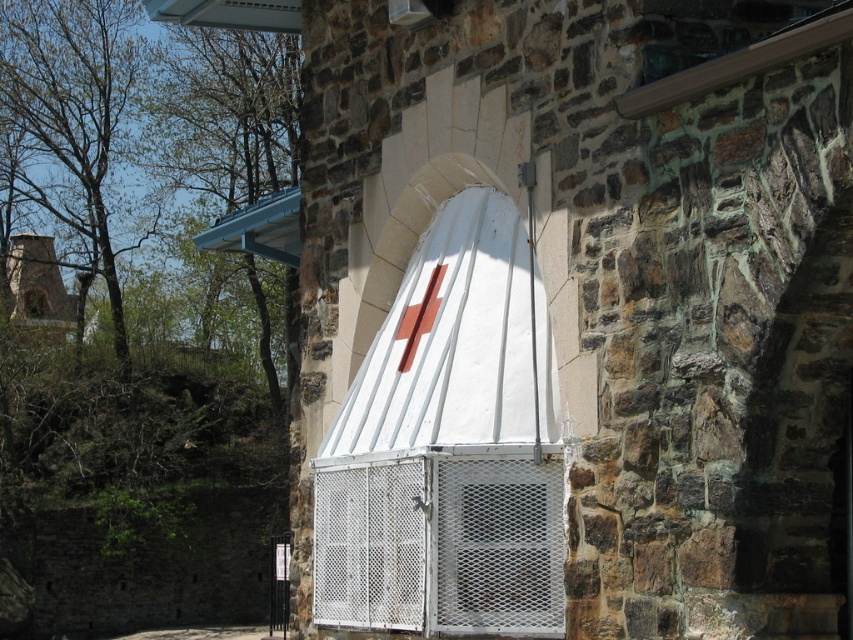
Question: Among these objects, which one is farthest from the camera?

Choices:
 (A) brick chimney at left
 (B) white mesh window at center

Answer: (B)

Question: Which of the following is the farthest from the observer?

Choices:
 (A) (30, 291)
 (B) (35, 314)

Answer: (A)

Question: Among these points, which one is farthest from the camera?

Choices:
 (A) (41, 307)
 (B) (51, 252)

Answer: (B)

Question: Is brick chimney at left above white mesh window at center?

Choices:
 (A) no
 (B) yes

Answer: (B)

Question: Is brick chimney at left thinner than white mesh window at center?

Choices:
 (A) yes
 (B) no

Answer: (B)

Question: Is brick chimney at left below white mesh window at center?

Choices:
 (A) yes
 (B) no

Answer: (B)